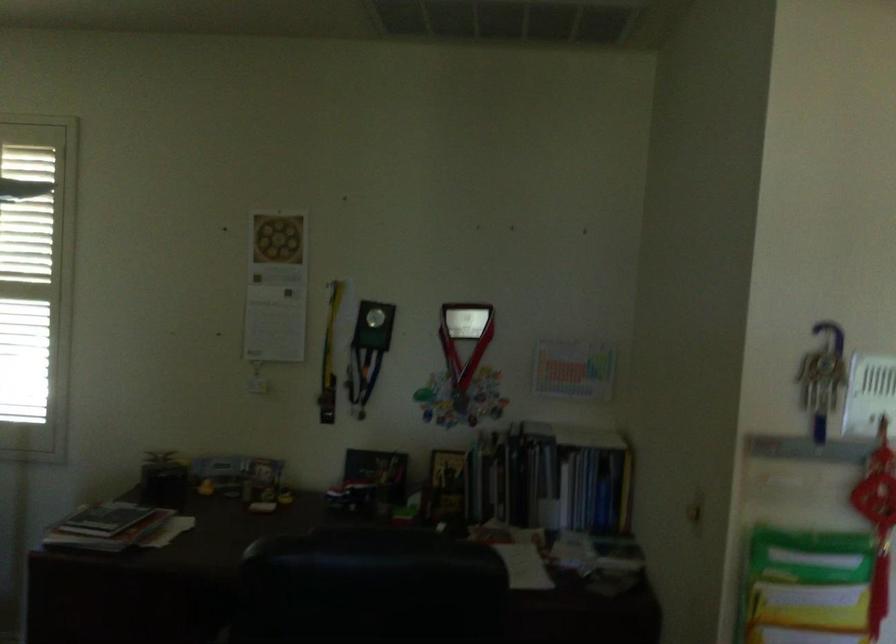
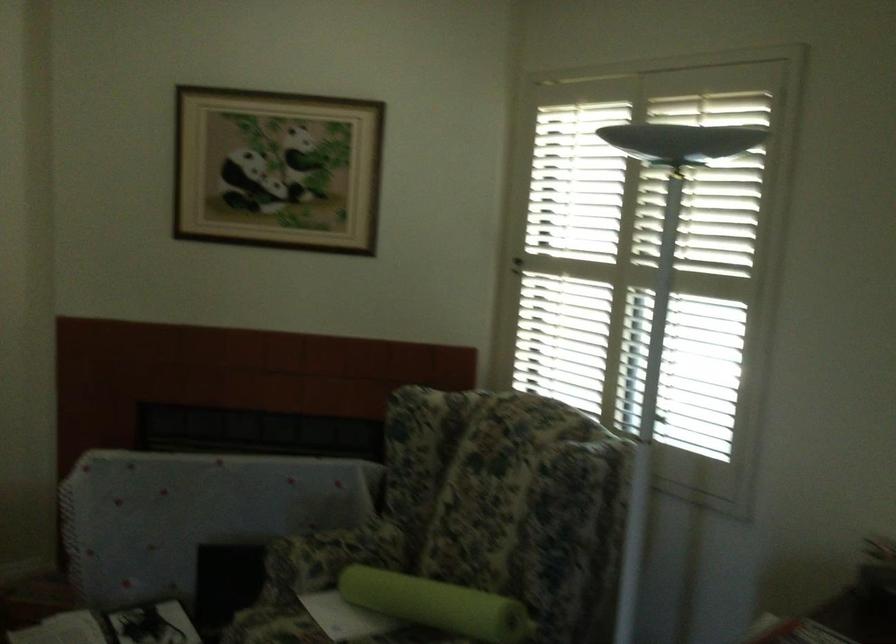
Question: Based on the continuous images, in which direction is the camera rotating? Reply with the corresponding letter.

Choices:
 (A) Left
 (B) Right
 (C) Up
 (D) Down

Answer: (A)